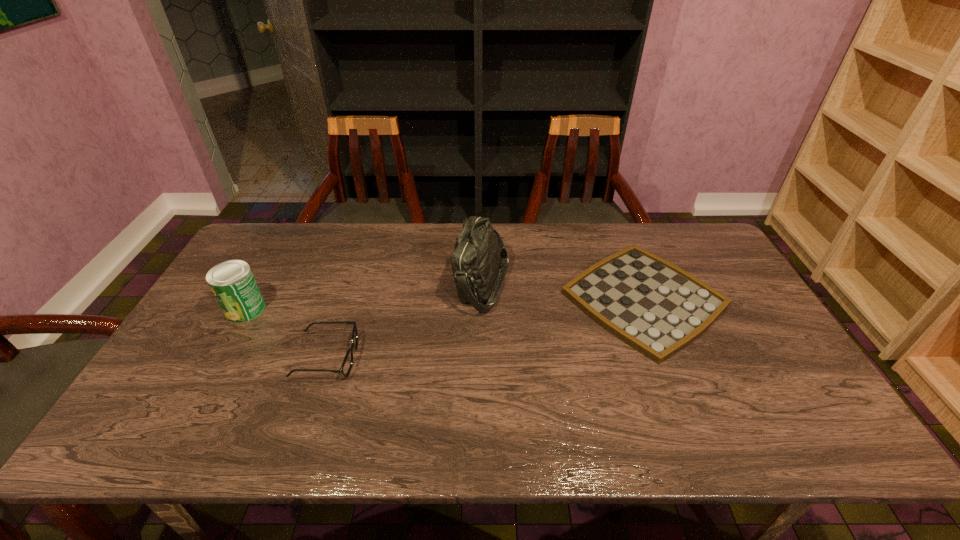
Where is `blank area at the near edge`? blank area at the near edge is located at coordinates (274, 443).

Identify the location of vacant space at the left edge of the desktop. The image size is (960, 540). (225, 323).

The width and height of the screenshot is (960, 540). In order to click on blank area at the far left corner in this screenshot , I will do `click(256, 233)`.

Image resolution: width=960 pixels, height=540 pixels. In the image, there is a desktop. Find the location of `vacant space at the near left corner`. vacant space at the near left corner is located at coordinates (160, 438).

At what (x,y) coordinates should I click in order to perform the action: click on vacant space that's between the third object from right to left and the can. Please return your answer as a coordinate pair (x, y). The height and width of the screenshot is (540, 960). Looking at the image, I should click on tap(286, 333).

Where is `blank region between the second tallest object and the spectacles`? This screenshot has width=960, height=540. blank region between the second tallest object and the spectacles is located at coordinates (286, 333).

The image size is (960, 540). What are the coordinates of `free space between the tallest object and the third object from right to left` in the screenshot? It's located at (404, 320).

Locate an element on the screen. The image size is (960, 540). free spot between the can and the rightmost object is located at coordinates (444, 304).

Where is `unoccupied position between the can and the spectacles`? This screenshot has height=540, width=960. unoccupied position between the can and the spectacles is located at coordinates (286, 333).

Where is `free space between the spectacles and the tallest object`? The height and width of the screenshot is (540, 960). free space between the spectacles and the tallest object is located at coordinates (404, 320).